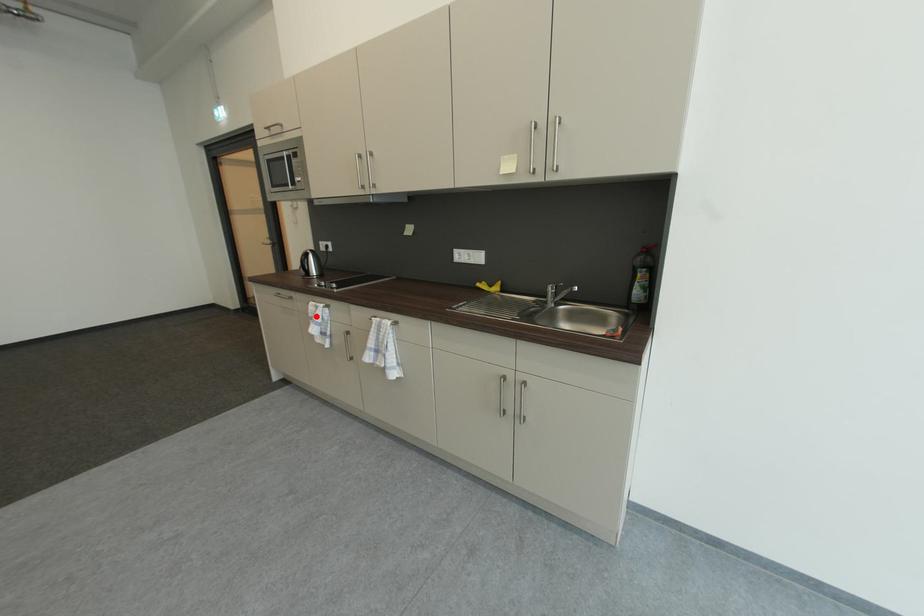
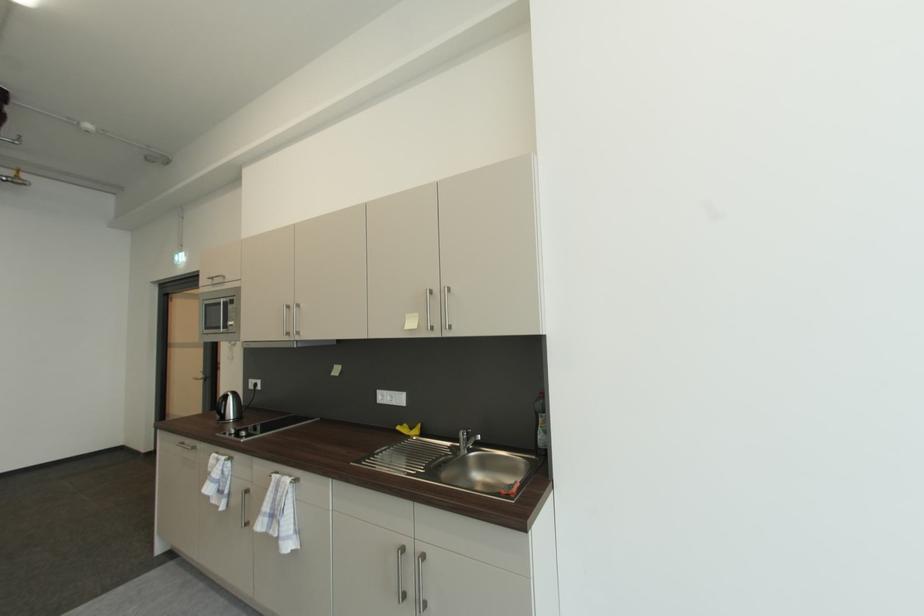
The point at the highlighted location is marked in the first image. Where is the corresponding point in the second image?

(215, 471)